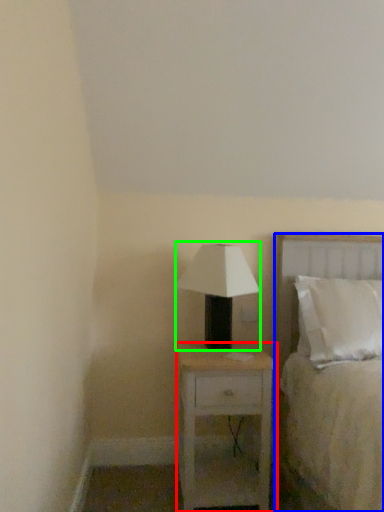
Question: Estimate the real-world distances between objects in this image. Which object is farther from nightstand (highlighted by a red box), bed (highlighted by a blue box) or table lamp (highlighted by a green box)?

Choices:
 (A) bed
 (B) table lamp

Answer: (B)